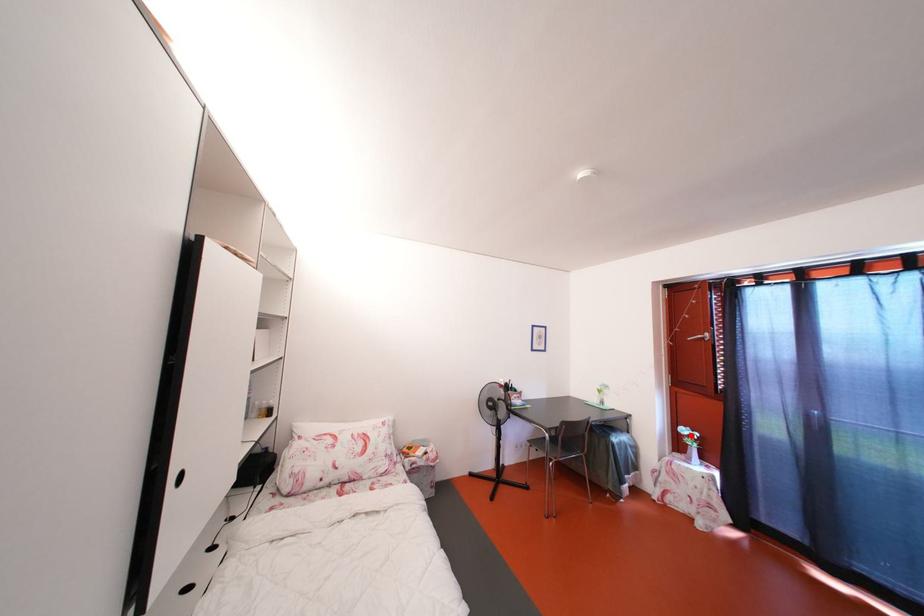
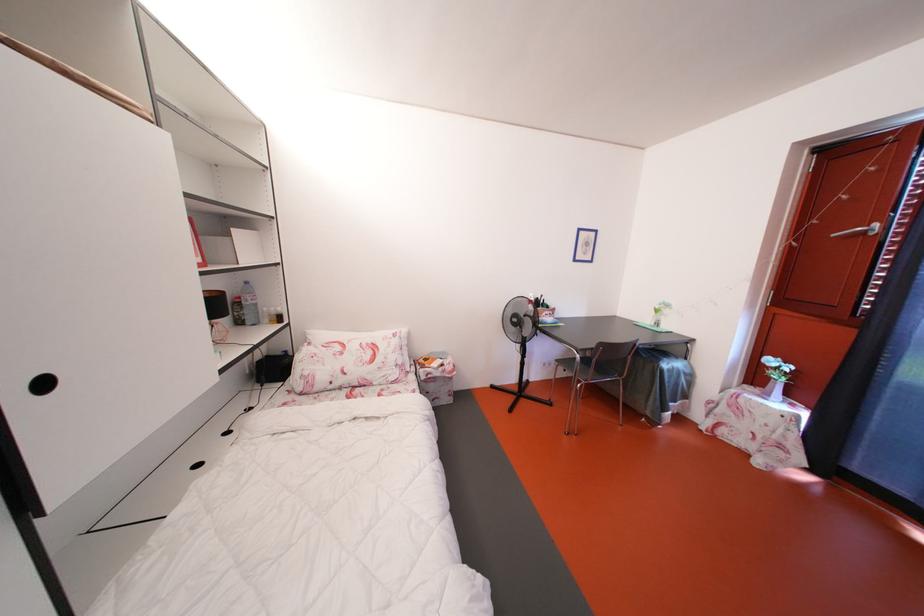
Locate, in the second image, the point that corresponds to the highlighted location in the first image.

(779, 367)